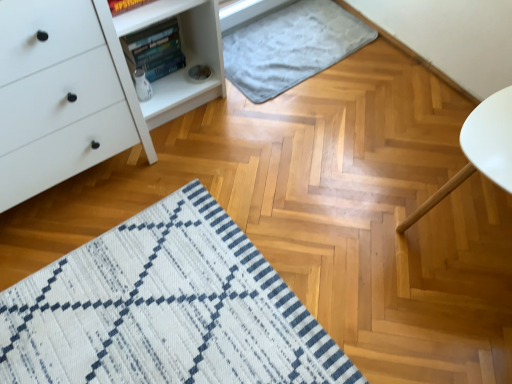
Where is `vacant space underneath white matte table at right (from a real-world perspective)`? vacant space underneath white matte table at right (from a real-world perspective) is located at coordinates (474, 228).